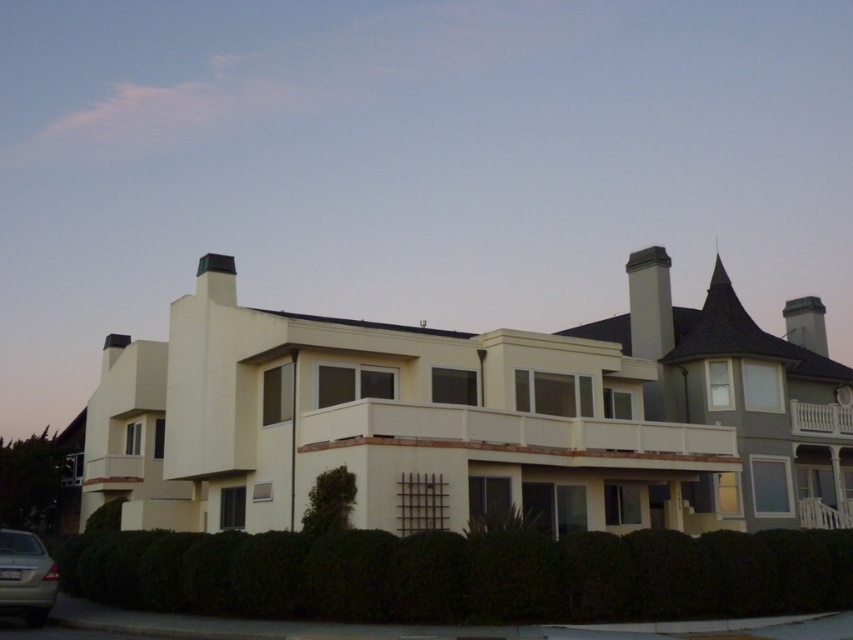
Measure the distance from green leafy hedge at lower center to silver metallic car at lower left.

A distance of 27.80 feet exists between green leafy hedge at lower center and silver metallic car at lower left.

Is green leafy hedge at lower center to the right of silver metallic car at lower left from the viewer's perspective?

Indeed, green leafy hedge at lower center is positioned on the right side of silver metallic car at lower left.

This screenshot has width=853, height=640. What are the coordinates of `green leafy hedge at lower center` in the screenshot? It's located at (463, 573).

Locate an element on the screen. The width and height of the screenshot is (853, 640). green leafy hedge at lower center is located at coordinates (463, 573).